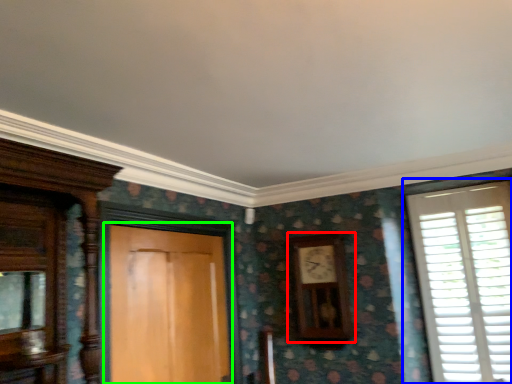
Question: Which is farther away from clock (highlighted by a red box)? window (highlighted by a blue box) or door (highlighted by a green box)?

Choices:
 (A) window
 (B) door

Answer: (B)